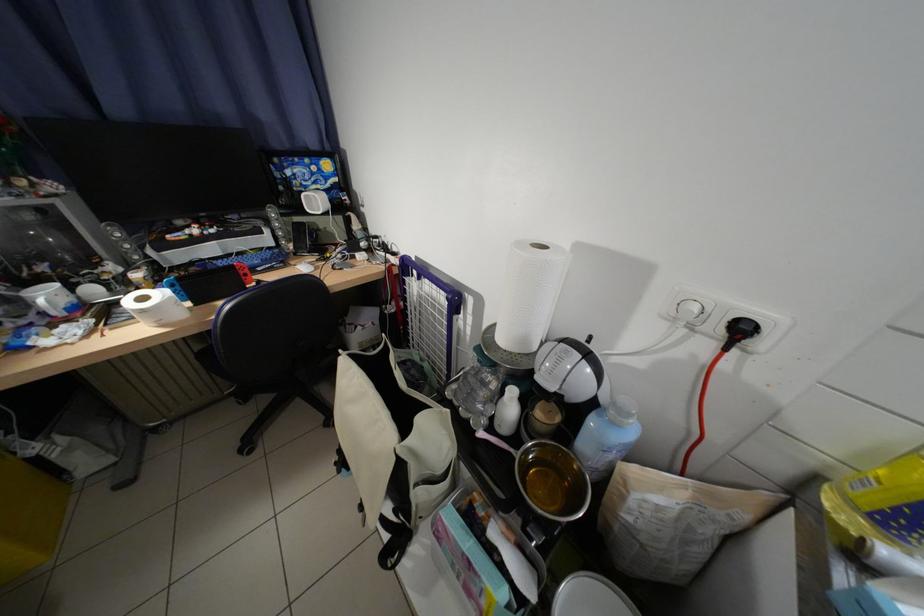
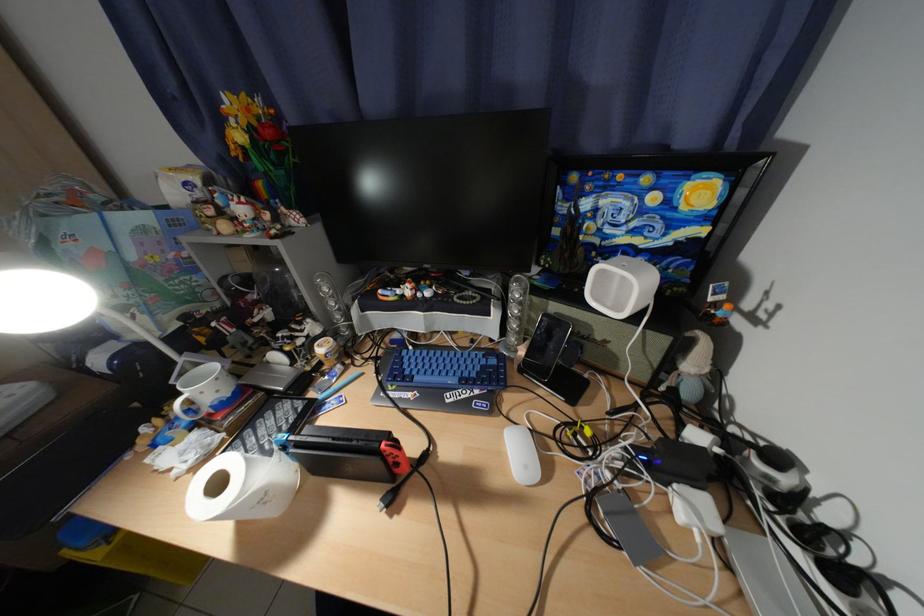
Locate, in the second image, the point that corresponds to point 317,198 in the first image.

(613, 273)